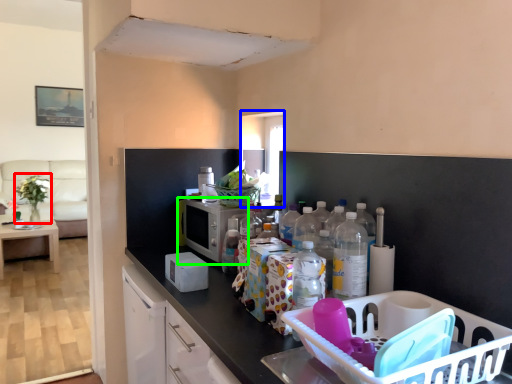
Question: Which object is positioned closest to plant (highlighted by a red box)? Select from window (highlighted by a blue box) and appliance (highlighted by a green box).

Choices:
 (A) window
 (B) appliance

Answer: (B)